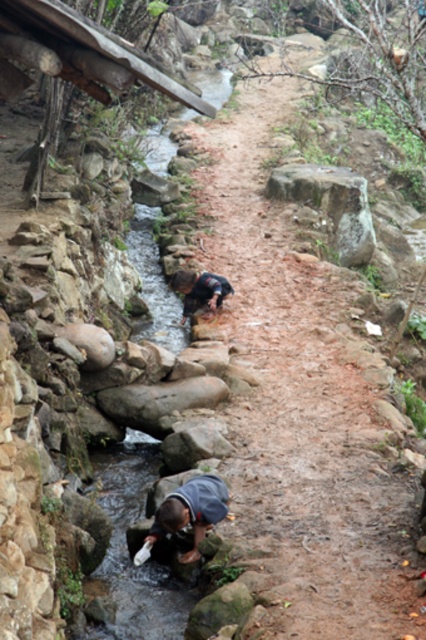
Question: Observing the image, what is the correct spatial positioning of gray rough rock at upper center in reference to gray fabric at lower center?

Choices:
 (A) right
 (B) left

Answer: (A)

Question: Is gray fabric at lower center above dark blue fabric at center?

Choices:
 (A) no
 (B) yes

Answer: (A)

Question: Which of the following is the farthest from the observer?

Choices:
 (A) (198, 284)
 (B) (328, 189)

Answer: (B)

Question: Which of the following is the farthest from the observer?

Choices:
 (A) (302, 448)
 (B) (192, 548)
 (C) (210, 288)

Answer: (C)

Question: Is dirt path at center wider than gray fabric at lower center?

Choices:
 (A) no
 (B) yes

Answer: (B)

Question: Among these objects, which one is nearest to the camera?

Choices:
 (A) dark blue fabric at center
 (B) dirt path at center

Answer: (B)